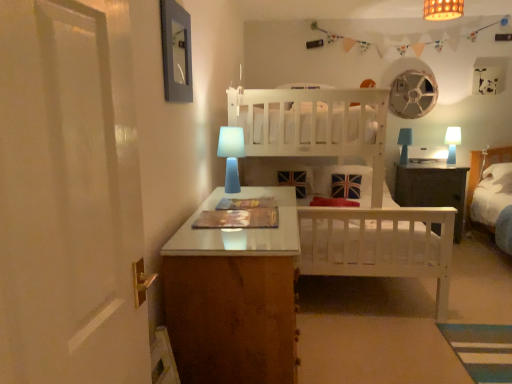
Question: Can you confirm if blue matte table lamp at right, which is counted as the 2th table lamp, starting from the left, is wider than bamboo lampshade at upper center?

Choices:
 (A) no
 (B) yes

Answer: (A)

Question: From the image's perspective, is blue matte table lamp at right, which is the second table lamp in right-to-left order, located above bamboo lampshade at upper center?

Choices:
 (A) yes
 (B) no

Answer: (B)

Question: Is bamboo lampshade at upper center inside blue matte table lamp at right, which is the second table lamp in right-to-left order?

Choices:
 (A) yes
 (B) no

Answer: (B)

Question: Is blue matte table lamp at right, the first table lamp from the back, taller than bamboo lampshade at upper center?

Choices:
 (A) no
 (B) yes

Answer: (B)

Question: Is blue matte table lamp at right, which is the second table lamp in right-to-left order, oriented towards bamboo lampshade at upper center?

Choices:
 (A) yes
 (B) no

Answer: (A)

Question: Relative to white wooden bed at center, is blue matte table lamp at right, arranged as the second table lamp when viewed from the back, in front or behind?

Choices:
 (A) front
 (B) behind

Answer: (B)

Question: From a real-world perspective, relative to white wooden bed at center, is blue matte table lamp at right, arranged as the second table lamp when viewed from the back, vertically above or below?

Choices:
 (A) above
 (B) below

Answer: (A)

Question: Based on their positions, is blue matte table lamp at right, arranged as the second table lamp when viewed from the back, located to the left or right of white wooden bed at center?

Choices:
 (A) right
 (B) left

Answer: (A)

Question: Considering the positions of blue matte table lamp at right, which is counted as the second table lamp, starting from the front, and white wooden bed at center in the image, is blue matte table lamp at right, which is counted as the second table lamp, starting from the front, bigger or smaller than white wooden bed at center?

Choices:
 (A) big
 (B) small

Answer: (B)

Question: Visually, is blue matte table lamp at right, which ranks as the third table lamp in front-to-back order, positioned to the left or to the right of blue matte table lamp at right, marked as the 1th table lamp in a right-to-left arrangement?

Choices:
 (A) right
 (B) left

Answer: (B)

Question: In the image, is blue matte table lamp at right, which is the second table lamp in right-to-left order, positioned in front of or behind blue matte table lamp at right, arranged as the second table lamp when viewed from the back?

Choices:
 (A) front
 (B) behind

Answer: (B)

Question: Considering the positions of blue matte table lamp at right, the first table lamp from the back, and blue matte table lamp at right, which is counted as the second table lamp, starting from the front, in the image, is blue matte table lamp at right, the first table lamp from the back, wider or thinner than blue matte table lamp at right, which is counted as the second table lamp, starting from the front,?

Choices:
 (A) wide
 (B) thin

Answer: (A)

Question: From a real-world perspective, is blue matte table lamp at right, which ranks as the third table lamp in front-to-back order, positioned above or below blue matte table lamp at right, marked as the 1th table lamp in a right-to-left arrangement?

Choices:
 (A) above
 (B) below

Answer: (A)

Question: Do you think blue matte table lamp at right, arranged as the second table lamp when viewed from the back, is within blue matte table lamp at center, acting as the 3th table lamp starting from the right, or outside of it?

Choices:
 (A) outside
 (B) inside

Answer: (A)

Question: Considering the positions of blue matte table lamp at right, arranged as the second table lamp when viewed from the back, and blue matte table lamp at center, the 1th table lamp in the front-to-back sequence, in the image, is blue matte table lamp at right, arranged as the second table lamp when viewed from the back, wider or thinner than blue matte table lamp at center, the 1th table lamp in the front-to-back sequence,?

Choices:
 (A) thin
 (B) wide

Answer: (A)